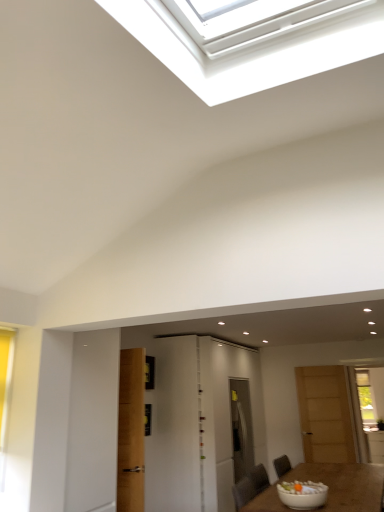
The image size is (384, 512). Describe the element at coordinates (330, 487) in the screenshot. I see `brown wooden table at lower center` at that location.

The image size is (384, 512). I want to click on white glossy bowl at lower right, so click(302, 494).

From a real-world perspective, is white glossy door at center, marked as the second door in a right-to-left arrangement, physically above white glossy door at center, which is counted as the 3th door, starting from the right?

No.

In terms of width, does white glossy door at center, marked as the second door in a right-to-left arrangement, look wider or thinner when compared to white glossy door at center, which is counted as the 1th door, starting from the left?

Clearly, white glossy door at center, marked as the second door in a right-to-left arrangement, has more width compared to white glossy door at center, which is counted as the 1th door, starting from the left.

From the image's perspective, is white glossy door at center, placed as the 2th door when sorted from left to right, above white glossy door at center, which is counted as the 1th door, starting from the left?

No, from the image's perspective, white glossy door at center, placed as the 2th door when sorted from left to right, is not on top of white glossy door at center, which is counted as the 1th door, starting from the left.

Which point is more distant from viewer, (303, 373) or (166, 360)?

The point (303, 373) is farther from the camera.

From a real-world perspective, which object stands above the other?

From a 3D spatial view, white glossy door at center, which is counted as the 3th door, starting from the right, is above.

Is wooden door at right, which is the first door in right-to-left order, thinner than white glossy door at center, which is counted as the 3th door, starting from the right?

Yes, wooden door at right, which is the first door in right-to-left order, is thinner than white glossy door at center, which is counted as the 3th door, starting from the right.

Can you confirm if brown wooden table at lower center is bigger than white glossy door at center, which is counted as the 3th door, starting from the right?

Correct, brown wooden table at lower center is larger in size than white glossy door at center, which is counted as the 3th door, starting from the right.

Looking at this image, is brown wooden table at lower center thinner than white glossy door at center, which is counted as the 1th door, starting from the left?

In fact, brown wooden table at lower center might be wider than white glossy door at center, which is counted as the 1th door, starting from the left.

Does point (343, 483) come closer to viewer compared to point (184, 470)?

No, it is not.

Is white glossy door at center, which is counted as the 1th door, starting from the left, looking in the opposite direction of wooden door at right, which is the first door in right-to-left order?

No.

Which is farther, (188,423) or (331,398)?

The point (331,398) is more distant.

Can you confirm if white glossy door at center, which is counted as the 3th door, starting from the right, is smaller than wooden door at right, marked as the 3th door in a left-to-right arrangement?

Actually, white glossy door at center, which is counted as the 3th door, starting from the right, might be larger than wooden door at right, marked as the 3th door in a left-to-right arrangement.

From the image's perspective, is white glossy door at center, which is counted as the 1th door, starting from the left, under wooden door at right, which is the first door in right-to-left order?

No, from the image's perspective, white glossy door at center, which is counted as the 1th door, starting from the left, is not beneath wooden door at right, which is the first door in right-to-left order.

Considering the sizes of objects wooden door at right, marked as the 3th door in a left-to-right arrangement, and brown wooden table at lower center in the image provided, who is shorter, wooden door at right, marked as the 3th door in a left-to-right arrangement, or brown wooden table at lower center?

Standing shorter between the two is brown wooden table at lower center.

From the picture: Is wooden door at right, which is the first door in right-to-left order, with brown wooden table at lower center?

→ No, wooden door at right, which is the first door in right-to-left order, is not in contact with brown wooden table at lower center.

Is wooden door at right, which is the first door in right-to-left order, further to camera compared to brown wooden table at lower center?

Yes.

Does wooden door at right, which is the first door in right-to-left order, have a greater width compared to brown wooden table at lower center?

Incorrect, the width of wooden door at right, which is the first door in right-to-left order, does not surpass that of brown wooden table at lower center.

Does brown wooden table at lower center have a lesser height compared to white glossy bowl at lower right?

In fact, brown wooden table at lower center may be taller than white glossy bowl at lower right.

Would you say brown wooden table at lower center is a long distance from white glossy bowl at lower right?

That's not correct — brown wooden table at lower center is a little close to white glossy bowl at lower right.

Is white glossy bowl at lower right at the back of brown wooden table at lower center?

No.

Considering the positions of objects brown wooden table at lower center and white glossy bowl at lower right in the image provided, who is behind, brown wooden table at lower center or white glossy bowl at lower right?

white glossy bowl at lower right is behind.

Is wooden door at right, marked as the 3th door in a left-to-right arrangement, at the back of white glossy door at center, placed as the 2th door when sorted from left to right?

No, white glossy door at center, placed as the 2th door when sorted from left to right, is not facing the opposite direction of wooden door at right, marked as the 3th door in a left-to-right arrangement.

Who is more distant, white glossy door at center, marked as the second door in a right-to-left arrangement, or wooden door at right, which is the first door in right-to-left order?

wooden door at right, which is the first door in right-to-left order, is further from the camera.

Does point (182, 366) come behind point (313, 376)?

No, (182, 366) is closer to viewer.

At what (x,y) coordinates should I click in order to perform the action: click on the 2nd door positioned below the white glossy door at center, which is counted as the 3th door, starting from the right (from the image's perspective). Please return your answer as a coordinate pair (x, y). The image size is (384, 512). Looking at the image, I should click on (198, 423).

From a real-world perspective, count 1st doors downward from the white glossy door at center, which is counted as the 1th door, starting from the left, and point to it. Please provide its 2D coordinates.

[(325, 415)]

Considering their positions, is brown wooden table at lower center positioned further to white glossy door at center, marked as the second door in a right-to-left arrangement, than white glossy door at center, which is counted as the 1th door, starting from the left?

Based on the image, brown wooden table at lower center appears to be further to white glossy door at center, marked as the second door in a right-to-left arrangement.

Which object lies further to the anchor point white glossy bowl at lower right, wooden door at right, which is the first door in right-to-left order, or brown wooden table at lower center?

Based on the image, wooden door at right, which is the first door in right-to-left order, appears to be further to white glossy bowl at lower right.

From the image, which object appears to be nearer to white glossy door at center, marked as the second door in a right-to-left arrangement, white glossy bowl at lower right or brown wooden table at lower center?

Among the two, white glossy bowl at lower right is located nearer to white glossy door at center, marked as the second door in a right-to-left arrangement.

When comparing their distances from white glossy bowl at lower right, does white glossy door at center, which is counted as the 3th door, starting from the right, or brown wooden table at lower center seem further?

Based on the image, white glossy door at center, which is counted as the 3th door, starting from the right, appears to be further to white glossy bowl at lower right.

Which object lies nearer to the anchor point white glossy door at center, which is counted as the 3th door, starting from the right, white glossy door at center, marked as the second door in a right-to-left arrangement, or brown wooden table at lower center?

white glossy door at center, marked as the second door in a right-to-left arrangement, lies closer to white glossy door at center, which is counted as the 3th door, starting from the right, than the other object.

Which object lies further to the anchor point white glossy door at center, marked as the second door in a right-to-left arrangement, white glossy door at center, which is counted as the 1th door, starting from the left, or wooden door at right, which is the first door in right-to-left order?

The object further to white glossy door at center, marked as the second door in a right-to-left arrangement, is wooden door at right, which is the first door in right-to-left order.

When comparing their distances from white glossy door at center, which is counted as the 1th door, starting from the left, does brown wooden table at lower center or wooden door at right, marked as the 3th door in a left-to-right arrangement, seem closer?

Among the two, brown wooden table at lower center is located nearer to white glossy door at center, which is counted as the 1th door, starting from the left.

From the image, which object appears to be farther from white glossy door at center, placed as the 2th door when sorted from left to right, white glossy bowl at lower right or wooden door at right, marked as the 3th door in a left-to-right arrangement?

The object further to white glossy door at center, placed as the 2th door when sorted from left to right, is wooden door at right, marked as the 3th door in a left-to-right arrangement.

The height and width of the screenshot is (512, 384). What are the coordinates of `bowl positioned between brown wooden table at lower center and white glossy door at center, placed as the 2th door when sorted from left to right, from near to far` in the screenshot? It's located at (302, 494).

Where is `door between white glossy bowl at lower right and white glossy door at center, placed as the 2th door when sorted from left to right, from front to back`? door between white glossy bowl at lower right and white glossy door at center, placed as the 2th door when sorted from left to right, from front to back is located at coordinates pyautogui.click(x=175, y=428).

Locate an element on the screen. The image size is (384, 512). door between brown wooden table at lower center and white glossy door at center, marked as the second door in a right-to-left arrangement, along the z-axis is located at coordinates (175, 428).

Locate an element on the screen. bowl between brown wooden table at lower center and white glossy door at center, which is counted as the 1th door, starting from the left, in the front-back direction is located at coordinates (302, 494).